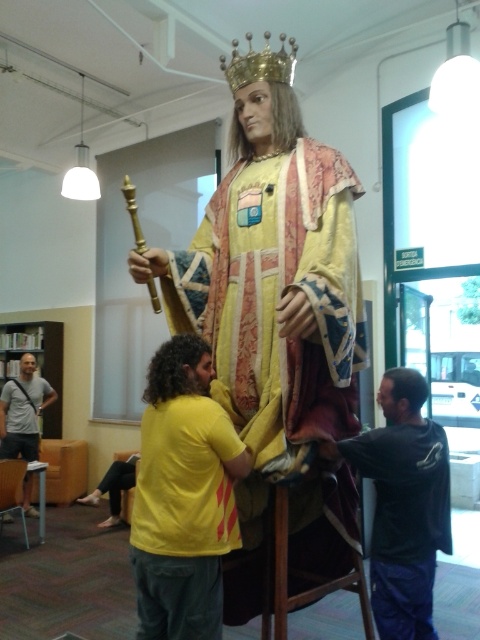
Is point (187, 602) less distant than point (28, 506)?

That is True.

Does yellow matte shirt at center have a lesser height compared to light gray t-shirt at left?

No, yellow matte shirt at center is not shorter than light gray t-shirt at left.

Between point (177, 632) and point (15, 426), which one is positioned in front?

Point (177, 632) is more forward.

Locate an element on the screen. This screenshot has width=480, height=640. yellow matte shirt at center is located at coordinates (183, 497).

Can you confirm if dark gray sweatshirt at center is thinner than gold metallic crown at upper center?

In fact, dark gray sweatshirt at center might be wider than gold metallic crown at upper center.

Who is more distant from viewer, (388, 624) or (248, 72)?

The point (388, 624) is behind.

Where is `dark gray sweatshirt at center`? The height and width of the screenshot is (640, 480). dark gray sweatshirt at center is located at coordinates (403, 504).

Identify the location of dark gray sweatshirt at center. point(403,504).

Does yellow matte shirt at center appear under wooden chair at lower left?

No.

Is point (204, 512) more distant than point (6, 506)?

No, it is not.

Where is `yellow matte shirt at center`? Image resolution: width=480 pixels, height=640 pixels. yellow matte shirt at center is located at coordinates (183, 497).